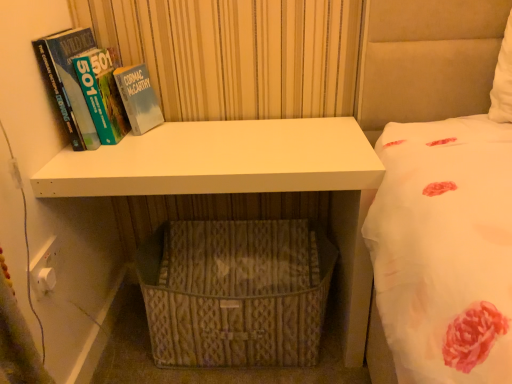
What is the approximate width of white matte shelf at center?

white matte shelf at center is 42.31 centimeters wide.

Where is `white matte shelf at center`? white matte shelf at center is located at coordinates (245, 181).

Where is `hardcover book at left`? This screenshot has width=512, height=384. hardcover book at left is located at coordinates (80, 89).

Locate an element on the screen. This screenshot has width=512, height=384. shelf above the woven beige basket at lower center (from the image's perspective) is located at coordinates (245, 181).

In the scene shown: Is white matte shelf at center positioned far away from woven beige basket at lower center?

white matte shelf at center is near woven beige basket at lower center, not far away.

Considering the relative sizes of white matte shelf at center and woven beige basket at lower center in the image provided, is white matte shelf at center thinner than woven beige basket at lower center?

Yes, white matte shelf at center is thinner than woven beige basket at lower center.

From a real-world perspective, who is located higher, white matte shelf at center or woven beige basket at lower center?

white matte shelf at center is physically above.

Does hardcover book at left come in front of white matte shelf at center?

No, hardcover book at left is further to the viewer.

From the image's perspective, would you say hardcover book at left is positioned over white matte shelf at center?

Indeed, from the image's perspective, hardcover book at left is shown above white matte shelf at center.

Is hardcover book at left facing towards white matte shelf at center?

No.

Would you say hardcover book at left contains white matte shelf at center?

No.

Could you tell me if woven beige basket at lower center is facing hardcover book at left?

No.

Does woven beige basket at lower center have a smaller size compared to hardcover book at left?

No.

Identify the location of basket that appears below the hardcover book at left (from the image's perspective). The image size is (512, 384). (234, 292).

Is woven beige basket at lower center positioned before hardcover book at left?

No, the depth of woven beige basket at lower center is greater than that of hardcover book at left.

Is hardcover book at left located outside woven beige basket at lower center?

Yes, hardcover book at left is located beyond the bounds of woven beige basket at lower center.

Considering the sizes of objects hardcover book at left and woven beige basket at lower center in the image provided, who is bigger, hardcover book at left or woven beige basket at lower center?

With larger size is woven beige basket at lower center.

Is hardcover book at left taller or shorter than woven beige basket at lower center?

Considering their sizes, hardcover book at left has more height than woven beige basket at lower center.

Considering the sizes of objects hardcover book at left and woven beige basket at lower center in the image provided, who is wider, hardcover book at left or woven beige basket at lower center?

woven beige basket at lower center.

Does woven beige basket at lower center turn towards white matte shelf at center?

Yes, woven beige basket at lower center is turned towards white matte shelf at center.

Is woven beige basket at lower center situated inside white matte shelf at center or outside?

woven beige basket at lower center is contained in white matte shelf at center.

Is point (213, 123) in front of point (112, 98)?

No, it is behind (112, 98).

Measure the distance between white matte shelf at center and hardcover book at left.

white matte shelf at center is 12.83 inches away from hardcover book at left.

Could you tell me if white matte shelf at center is facing hardcover book at left?

No, white matte shelf at center is not turned towards hardcover book at left.

From their relative heights in the image, would you say white matte shelf at center is taller or shorter than hardcover book at left?

In the image, white matte shelf at center appears to be taller than hardcover book at left.

This screenshot has width=512, height=384. What are the coordinates of `basket below the white matte shelf at center (from a real-world perspective)` in the screenshot? It's located at [234, 292].

The image size is (512, 384). I want to click on book on the left of white matte shelf at center, so click(x=80, y=89).

Considering their positions, is white matte shelf at center positioned further to woven beige basket at lower center than hardcover book at left?

hardcover book at left.

Which object lies nearer to the anchor point white matte shelf at center, woven beige basket at lower center or hardcover book at left?

woven beige basket at lower center lies closer to white matte shelf at center than the other object.

Considering their positions, is hardcover book at left positioned closer to woven beige basket at lower center than white matte shelf at center?

Among the two, white matte shelf at center is located nearer to woven beige basket at lower center.

Which object lies further to the anchor point hardcover book at left, woven beige basket at lower center or white matte shelf at center?

Among the two, woven beige basket at lower center is located further to hardcover book at left.

Estimate the real-world distances between objects in this image. Which object is closer to hardcover book at left, white matte shelf at center or woven beige basket at lower center?

The object closer to hardcover book at left is white matte shelf at center.

Looking at the image, which one is located further to white matte shelf at center, hardcover book at left or woven beige basket at lower center?

hardcover book at left.

The image size is (512, 384). What are the coordinates of `shelf between hardcover book at left and woven beige basket at lower center in the up-down direction` in the screenshot? It's located at (245, 181).